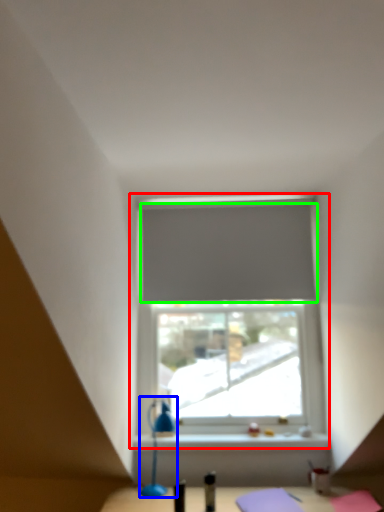
Question: Based on their relative distances, which object is nearer to window (highlighted by a red box)? Choose from table lamp (highlighted by a blue box) and curtain (highlighted by a green box).

Choices:
 (A) table lamp
 (B) curtain

Answer: (B)